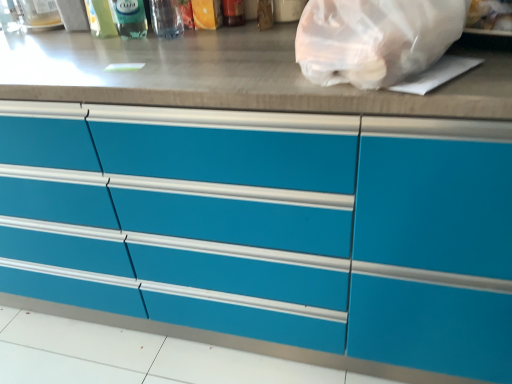
Question: Can you confirm if transparent plastic bottle at upper left, which is the second bottle in right-to-left order, is positioned to the left of translucent plastic bottle at upper center, which is the first bottle from left to right?

Choices:
 (A) yes
 (B) no

Answer: (B)

Question: Is transparent plastic bottle at upper left, which is the 2th bottle in left-to-right order, beside translucent plastic bottle at upper center, which appears as the third bottle when viewed from the right?

Choices:
 (A) no
 (B) yes

Answer: (B)

Question: Could translucent plastic bottle at upper center, which is the first bottle from left to right, be considered to be inside transparent plastic bottle at upper left, which is the 2th bottle in left-to-right order?

Choices:
 (A) yes
 (B) no

Answer: (B)

Question: Are transparent plastic bottle at upper left, which is the second bottle in right-to-left order, and translucent plastic bottle at upper center, which is the first bottle from left to right, far apart?

Choices:
 (A) no
 (B) yes

Answer: (A)

Question: Does transparent plastic bottle at upper left, which is the second bottle in right-to-left order, have a lesser height compared to translucent plastic bottle at upper center, which appears as the third bottle when viewed from the right?

Choices:
 (A) yes
 (B) no

Answer: (A)

Question: Considering the positions of point (154, 163) and point (138, 21), is point (154, 163) closer or farther from the camera than point (138, 21)?

Choices:
 (A) farther
 (B) closer

Answer: (B)

Question: Considering the positions of matte blue drawers at center and transparent plastic bottle at upper left, which is the 2th bottle in left-to-right order, in the image, is matte blue drawers at center wider or thinner than transparent plastic bottle at upper left, which is the 2th bottle in left-to-right order,?

Choices:
 (A) thin
 (B) wide

Answer: (B)

Question: In the image, is matte blue drawers at center on the left side or the right side of transparent plastic bottle at upper left, which is the 2th bottle in left-to-right order?

Choices:
 (A) right
 (B) left

Answer: (A)

Question: Is matte blue drawers at center taller or shorter than transparent plastic bottle at upper left, which is the 2th bottle in left-to-right order?

Choices:
 (A) short
 (B) tall

Answer: (B)

Question: Based on their positions, is transparent plastic bag at upper right located to the left or right of matte blue drawers at center?

Choices:
 (A) left
 (B) right

Answer: (B)

Question: Would you say transparent plastic bag at upper right is inside or outside matte blue drawers at center?

Choices:
 (A) inside
 (B) outside

Answer: (B)

Question: Relative to matte blue drawers at center, is transparent plastic bag at upper right in front or behind?

Choices:
 (A) front
 (B) behind

Answer: (B)

Question: Is point (348, 46) positioned closer to the camera than point (249, 218)?

Choices:
 (A) closer
 (B) farther

Answer: (A)

Question: From the image's perspective, is translucent plastic bottle at upper center, which appears as the third bottle when viewed from the right, located above or below transparent plastic bottle at upper center, placed as the third bottle when sorted from left to right?

Choices:
 (A) above
 (B) below

Answer: (A)

Question: From a real-world perspective, is translucent plastic bottle at upper center, which is the first bottle from left to right, above or below transparent plastic bottle at upper center, marked as the 1th bottle in a right-to-left arrangement?

Choices:
 (A) above
 (B) below

Answer: (B)